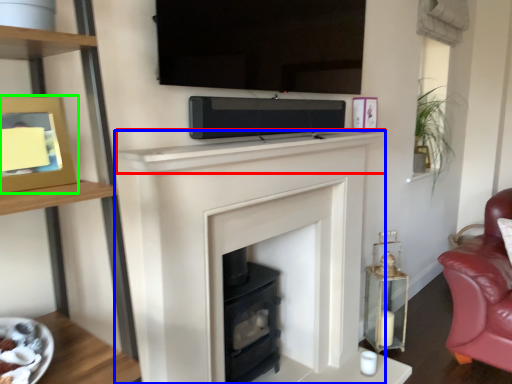
Question: Which object is the closest to the mantle (highlighted by a red box)? Choose among these: fireplace (highlighted by a blue box) or picture frame (highlighted by a green box).

Choices:
 (A) fireplace
 (B) picture frame

Answer: (A)